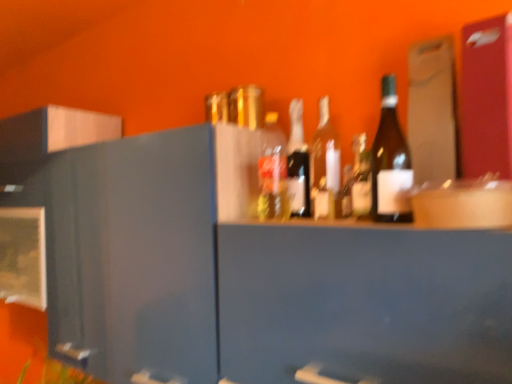
Question: Which direction should I rotate to face translucent glass bottle at center, the 6th bottle when ordered from front to back, — up or down?

Choices:
 (A) down
 (B) up

Answer: (B)

Question: Which direction should I rotate to look at translucent glass bottle at center, the 2th bottle in the back-to-front sequence?

Choices:
 (A) right
 (B) left

Answer: (A)

Question: Is matte glass bottle at center, positioned as the 2th bottle in front-to-back order, positioned in front of matte glass bottle at center, which is counted as the third bottle, starting from the front?

Choices:
 (A) yes
 (B) no

Answer: (A)

Question: Is matte glass bottle at center, positioned as the 2th bottle in front-to-back order, wider than matte glass bottle at center, which is the fourth bottle from back to front?

Choices:
 (A) yes
 (B) no

Answer: (B)

Question: Can you confirm if matte glass bottle at center, positioned as the 2th bottle in front-to-back order, is taller than matte glass bottle at center, which is the fourth bottle from back to front?

Choices:
 (A) no
 (B) yes

Answer: (A)

Question: From the image's perspective, does matte glass bottle at center, positioned as the fifth bottle in back-to-front order, appear higher than matte glass bottle at center, which is counted as the third bottle, starting from the front?

Choices:
 (A) no
 (B) yes

Answer: (A)

Question: From the image's perspective, is matte glass bottle at center, positioned as the fifth bottle in back-to-front order, located beneath matte glass bottle at center, which is the fourth bottle from back to front?

Choices:
 (A) yes
 (B) no

Answer: (A)

Question: Can you confirm if matte glass bottle at center, positioned as the fifth bottle in back-to-front order, is positioned to the right of matte glass bottle at center, which is the fourth bottle from back to front?

Choices:
 (A) yes
 (B) no

Answer: (B)

Question: Is matte glass bottle at center, positioned as the 2th bottle in front-to-back order, located within matte glass bottle at center, which is the fourth bottle from back to front?

Choices:
 (A) no
 (B) yes

Answer: (A)

Question: From a real-world perspective, is matte glass bottle at center, which is counted as the third bottle, starting from the front, physically above matte glass bottle at center, positioned as the 2th bottle in front-to-back order?

Choices:
 (A) yes
 (B) no

Answer: (A)

Question: Is matte glass bottle at center, which is the fourth bottle from back to front, oriented towards matte glass bottle at center, positioned as the 2th bottle in front-to-back order?

Choices:
 (A) yes
 (B) no

Answer: (B)

Question: Can you confirm if matte glass bottle at center, which is counted as the third bottle, starting from the front, is positioned to the right of matte glass bottle at center, positioned as the 2th bottle in front-to-back order?

Choices:
 (A) no
 (B) yes

Answer: (B)

Question: Is matte glass bottle at center, which is counted as the third bottle, starting from the front, positioned with its back to matte glass bottle at center, positioned as the fifth bottle in back-to-front order?

Choices:
 (A) yes
 (B) no

Answer: (B)

Question: Is matte glass bottle at center, which is counted as the third bottle, starting from the front, positioned before matte glass bottle at center, positioned as the 2th bottle in front-to-back order?

Choices:
 (A) no
 (B) yes

Answer: (A)

Question: From a real-world perspective, is translucent glass bottle at center, arranged as the 1th bottle when viewed from the back, located beneath matte glass bottle at center, positioned as the 2th bottle in front-to-back order?

Choices:
 (A) yes
 (B) no

Answer: (B)